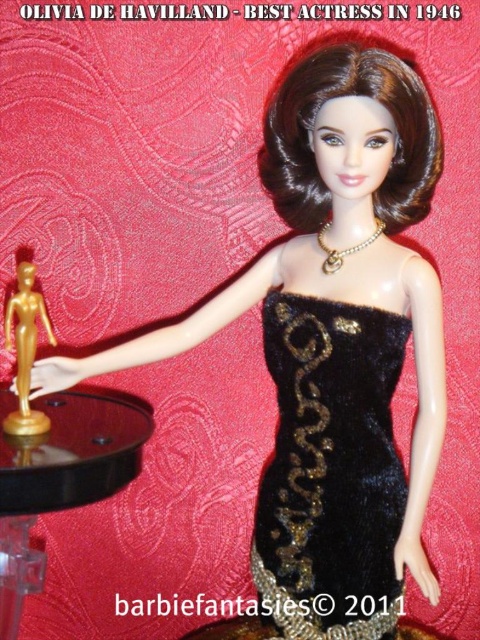
Question: Is velvet black dress at center bigger than gold metallic statuette at center?

Choices:
 (A) no
 (B) yes

Answer: (A)

Question: Observing the image, what is the correct spatial positioning of black glossy table at lower left in reference to gold metallic statuette at center?

Choices:
 (A) right
 (B) left

Answer: (A)

Question: Estimate the real-world distances between objects in this image. Which object is farther from the black glossy table at lower left?

Choices:
 (A) gold metallic statuette at center
 (B) velvet black dress at center

Answer: (B)

Question: Which object is the farthest from the velvet black dress at center?

Choices:
 (A) black glossy table at lower left
 (B) gold metallic statuette at center

Answer: (B)

Question: Which point is farther to the camera?

Choices:
 (A) gold metallic statuette at center
 (B) black glossy table at lower left
 (C) velvet black dress at center

Answer: (A)

Question: Does black glossy table at lower left appear over gold metallic statuette at center?

Choices:
 (A) no
 (B) yes

Answer: (A)